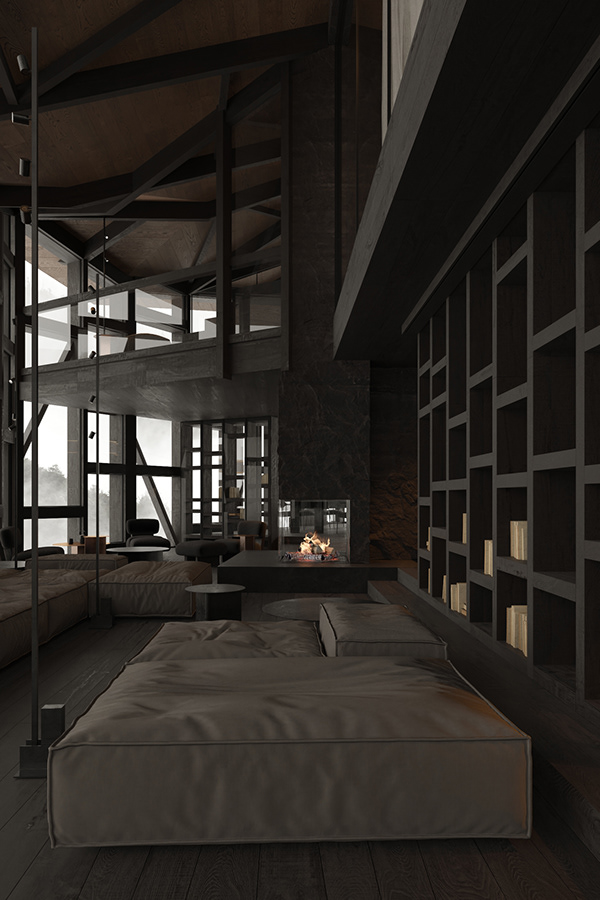
At what (x,y) coordinates should I click in order to perform the action: click on round metal tables. Please return your answer as a coordinate pair (x, y). The width and height of the screenshot is (600, 900). Looking at the image, I should click on (212, 591), (291, 608), (146, 549).